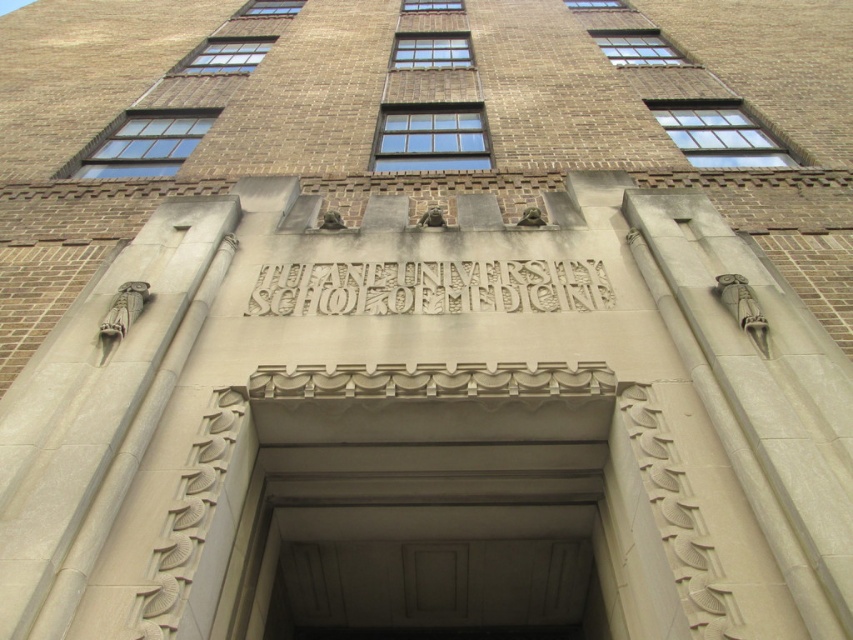
You are standing at the entrance of the University School of Medicine. You see a beige stone sign at center and a carved stone text at center. Which one is positioned to the right side?

The beige stone sign at center is positioned to the right of the carved stone text at center.

You are a student entering the University School of Medicine and notice two stone elements above the entrance. The beige stone sign at center and the carved stone text at center. Which one is taller?

The beige stone sign at center is taller than the carved stone text at center.

You are standing at the entrance of the University School of Medicine and notice two points marked on the facade. The first point is at coordinates point (431,442) and the second is at point (398,278). Which of these points appears closer to you?

Point (431,442) is closer to the camera than point (398,278), so the first point appears closer to you.